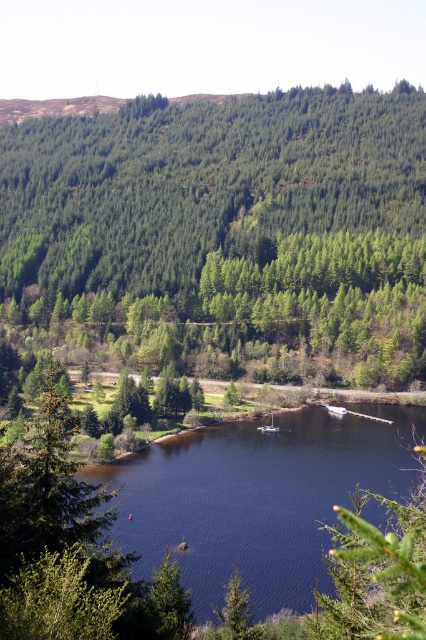
Between green matte forest at upper center and dark blue water at center, which one is positioned higher?

green matte forest at upper center is above.

Is point (31, 305) positioned in front of point (278, 605)?

No.

Find the location of a particular element. green matte forest at upper center is located at coordinates (226, 232).

Is green matte forest at upper center bigger than white plastic boat at center?

Indeed, green matte forest at upper center has a larger size compared to white plastic boat at center.

Does green matte forest at upper center appear on the right side of white plastic boat at center?

No, green matte forest at upper center is not to the right of white plastic boat at center.

At what (x,y) coordinates should I click in order to perform the action: click on green matte forest at upper center. Please return your answer as a coordinate pair (x, y). Looking at the image, I should click on (226, 232).

The width and height of the screenshot is (426, 640). I want to click on green matte forest at upper center, so click(x=226, y=232).

From the picture: Who is shorter, dark blue water at center or white plastic boat at center?

white plastic boat at center is shorter.

Does point (140, 484) come farther from viewer compared to point (273, 413)?

That is False.

Find the location of a particular element. The height and width of the screenshot is (640, 426). dark blue water at center is located at coordinates (256, 499).